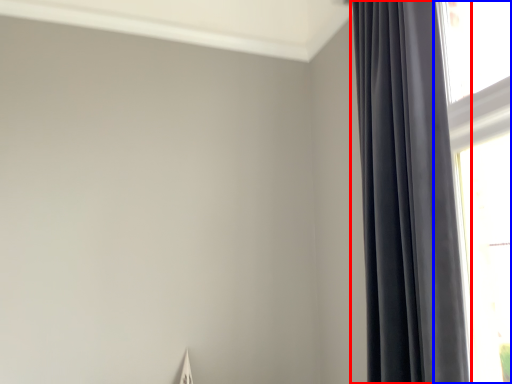
Question: Which point is further to the camera, curtain (highlighted by a red box) or window (highlighted by a blue box)?

Choices:
 (A) curtain
 (B) window

Answer: (B)